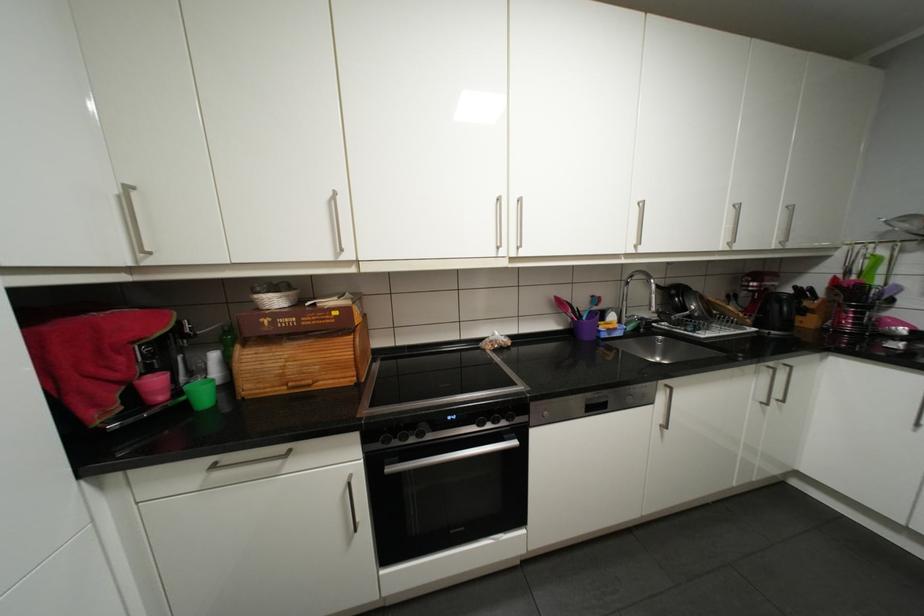
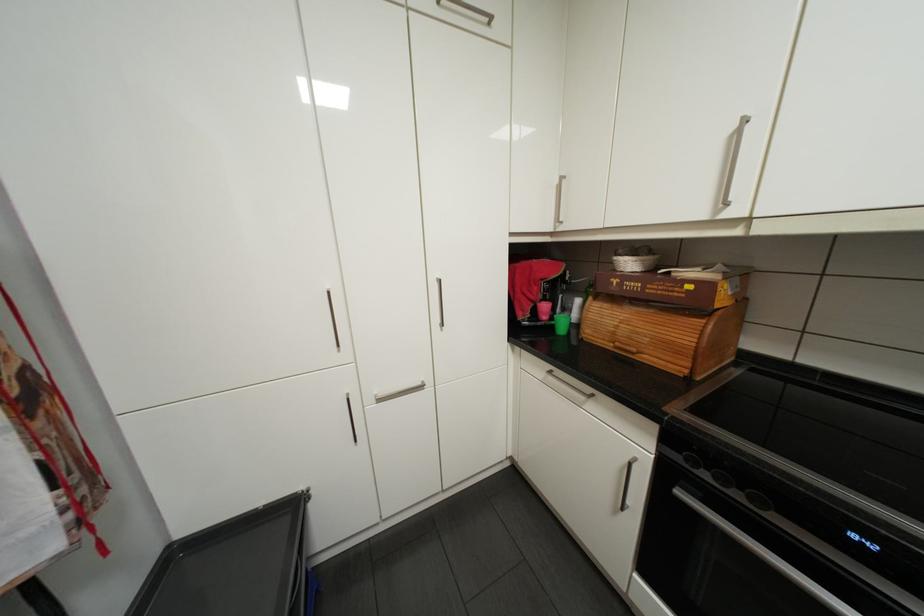
Locate, in the second image, the point that corresponds to pixel 283 300 in the first image.

(637, 262)